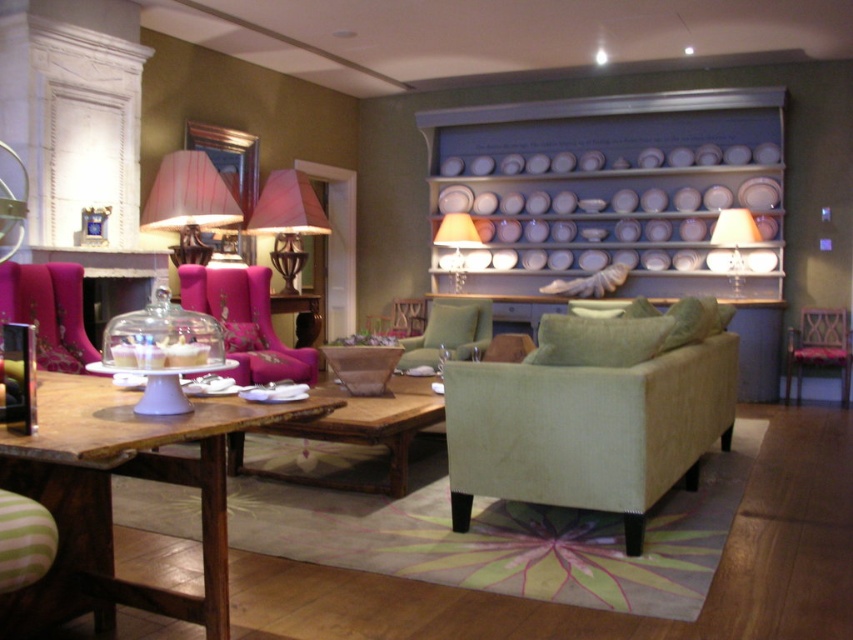
You are sitting in the velvet pink armchair at center and want to reach the green fabric armchair at center. Which direction should you move to get there?

The velvet pink armchair at center is to the left of the green fabric armchair at center, so you should move to the right to reach it.

You are sitting in the green fabric armchair at center and want to reach the matte white lampshade at upper right. Which direction should you move to get closer to the lampshade?

You should move to the right because the green fabric armchair at center is to the left of the matte white lampshade at upper right, so moving right will bring you closer to the lampshade.

You are sitting in the green fabric armchair at center and want to move to the pink fabric armchair at right. Which direction should you move to reach it?

To move from the green fabric armchair at center to the pink fabric armchair at right, you should move to the right since the green fabric armchair at center is to the left of the pink fabric armchair at right.